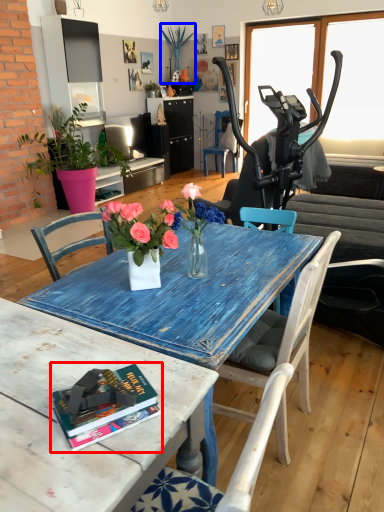
Question: Which object appears farthest to the camera in this image, book (highlighted by a red box) or plant (highlighted by a blue box)?

Choices:
 (A) book
 (B) plant

Answer: (B)